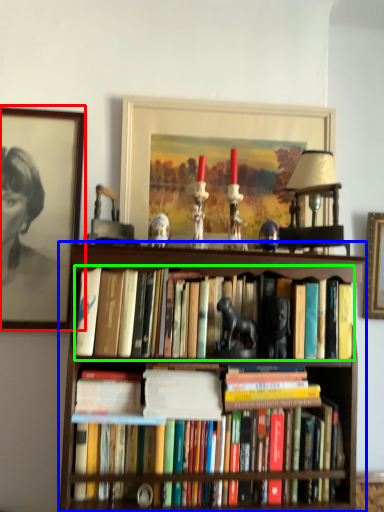
Question: Which is nearer to the picture frame (highlighted by a red box)? bookcase (highlighted by a blue box) or book (highlighted by a green box).

Choices:
 (A) bookcase
 (B) book

Answer: (A)